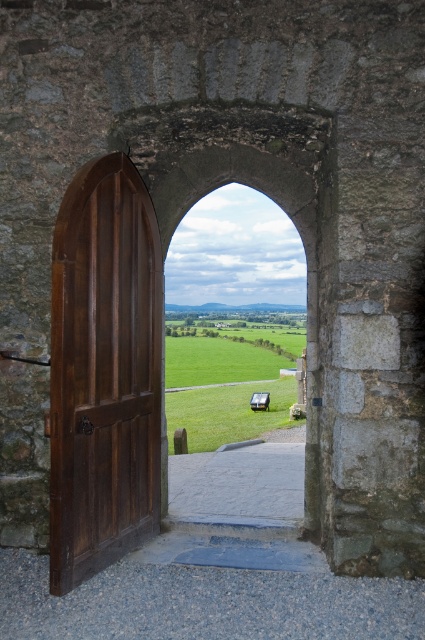
Question: Which point is closer to the camera?

Choices:
 (A) (x=299, y=352)
 (B) (x=119, y=390)

Answer: (B)

Question: Can you confirm if polished dark wood door at left is positioned below green grass field at center?

Choices:
 (A) no
 (B) yes

Answer: (A)

Question: Does polished dark wood door at left have a smaller size compared to green grass field at center?

Choices:
 (A) yes
 (B) no

Answer: (A)

Question: Is polished dark wood door at left to the right of green grass field at center from the viewer's perspective?

Choices:
 (A) no
 (B) yes

Answer: (A)